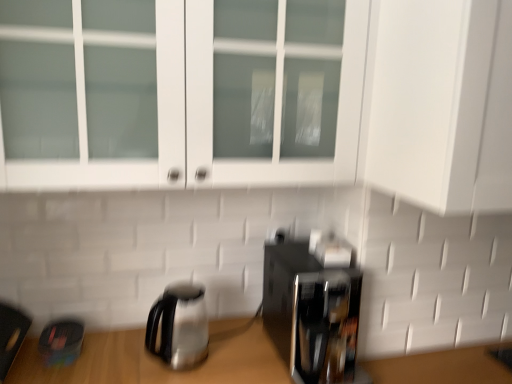
Find the location of a particular element. free space to the right of stainless steel kettle at lower left is located at coordinates (232, 355).